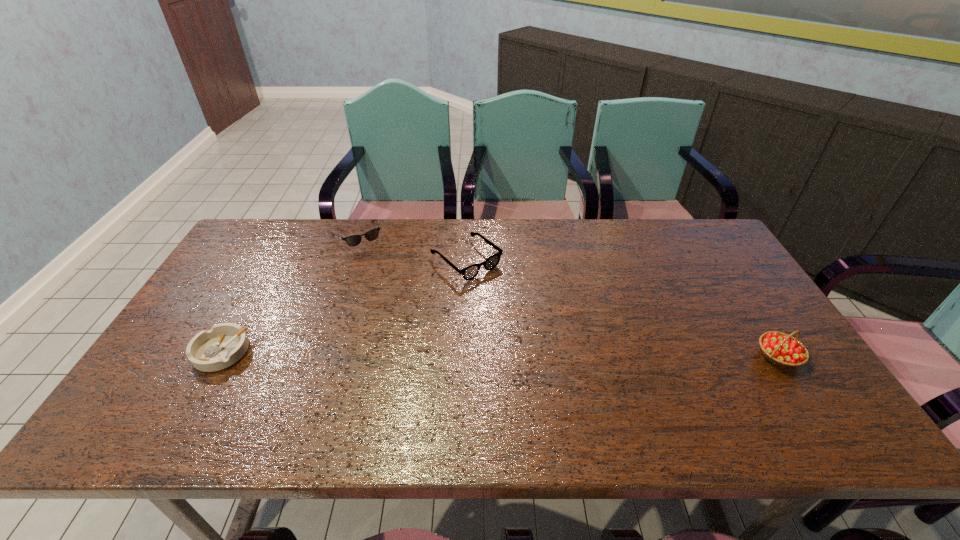
This screenshot has height=540, width=960. I want to click on vacant space on the desktop that is between the shortest object and the tallest object and is positioned on the arms of the spectacles, so click(x=574, y=354).

Locate an element on the screen. The height and width of the screenshot is (540, 960). free space on the desktop that is between the leftmost object and the rightmost object and is positioned on the front-facing side of the sunglasses is located at coordinates (431, 353).